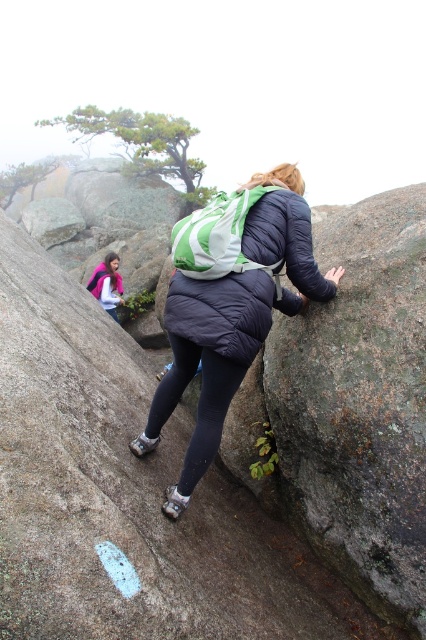
From the picture: You are a hiker trying to reach the top of the mountain. You see a rough granite boulder at center and a matte blue down jacket at center. Which object is located to the left of the other?

The rough granite boulder at center is positioned on the left side of matte blue down jacket at center.

You are a hiker planning to climb the rough granite boulder at center. You are currently wearing the matte blue jacket at center. Considering the height of the boulder, do you think you can safely climb it while wearing the jacket?

The rough granite boulder at center is taller than the matte blue jacket at center. Since the boulder is taller, you can safely climb it while wearing the matte blue jacket at center as the jacket does not affect your ability to climb based on height alone.

You are a hiker trying to reach the summit. You see a rough granite boulder at center and a matte blue down jacket at center. Which object is closer to you?

The rough granite boulder at center is closer to the viewer than the matte blue down jacket at center, so the rough granite boulder at center is closer to you.